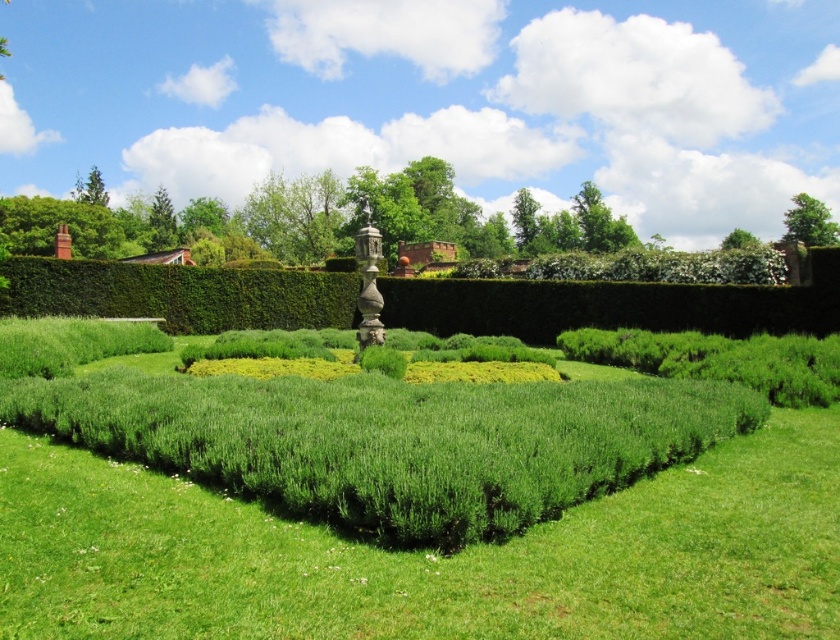
Is green soft grass at center to the right of green leafy bush at upper right from the viewer's perspective?

In fact, green soft grass at center is to the left of green leafy bush at upper right.

Is point (675, 564) positioned behind point (785, 220)?

No, (675, 564) is in front of (785, 220).

Is point (445, 588) less distant than point (802, 237)?

Yes, point (445, 588) is closer to viewer.

At what (x,y) coordinates should I click in order to perform the action: click on green soft grass at center. Please return your answer as a coordinate pair (x, y). Looking at the image, I should click on (428, 554).